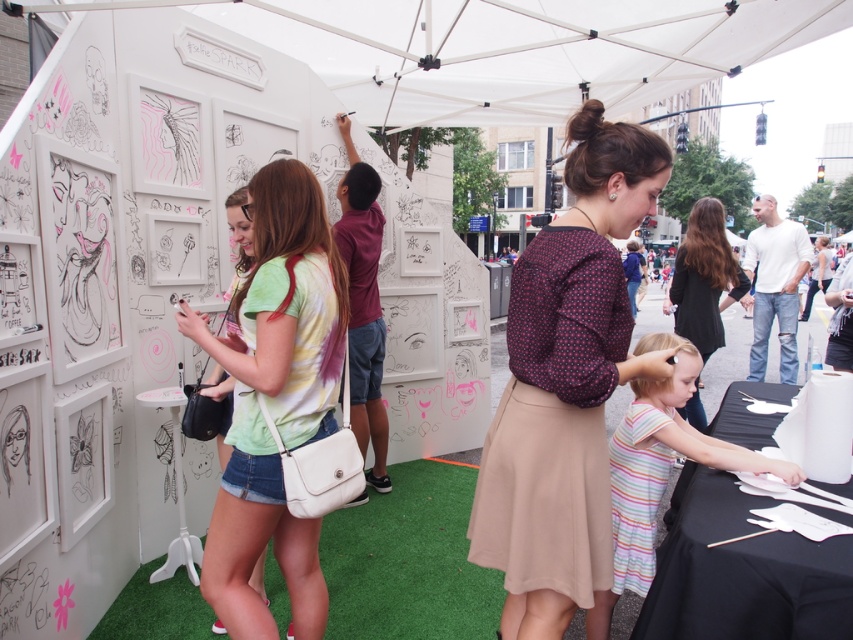
You are a photographer standing at the entrance of the event. You want to take a photo that includes both the white fabric canopy at upper center and the striped cotton dress at lower center. Which object should you position closer to the camera to ensure both are in focus?

You should position the striped cotton dress at lower center closer to the camera since the white fabric canopy at upper center is further away. This way, both objects will be in focus as the canopy is already farther back.